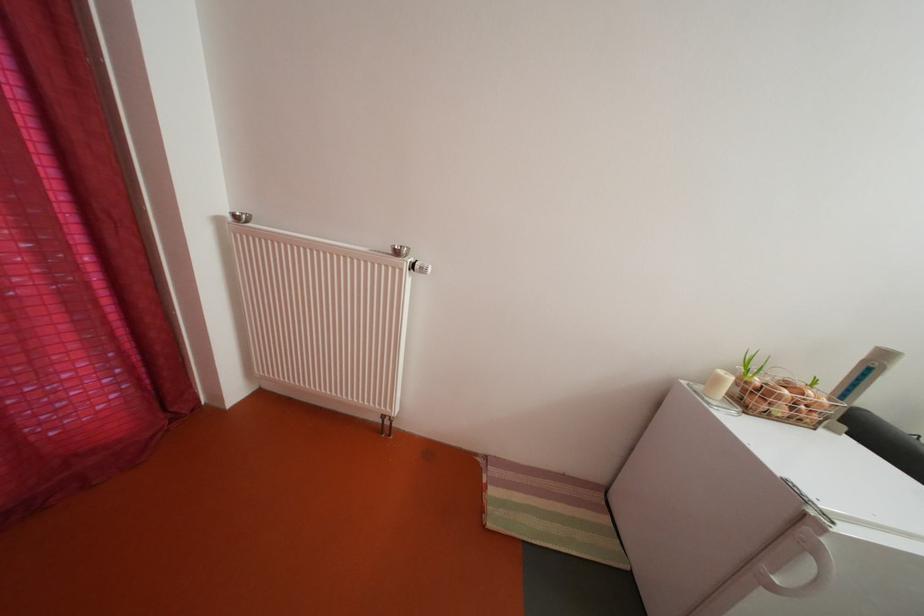
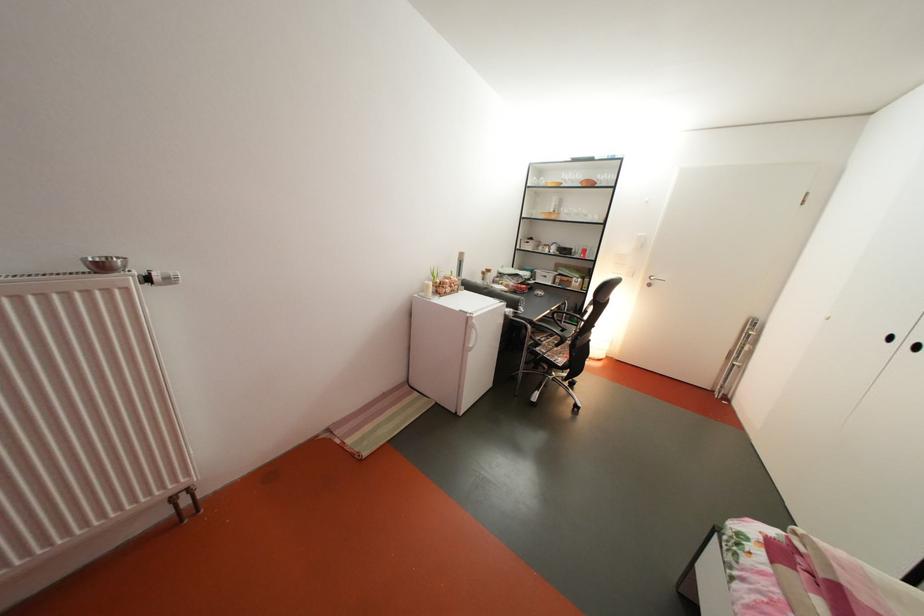
The point at (407, 254) is marked in the first image. Where is the corresponding point in the second image?

(107, 270)